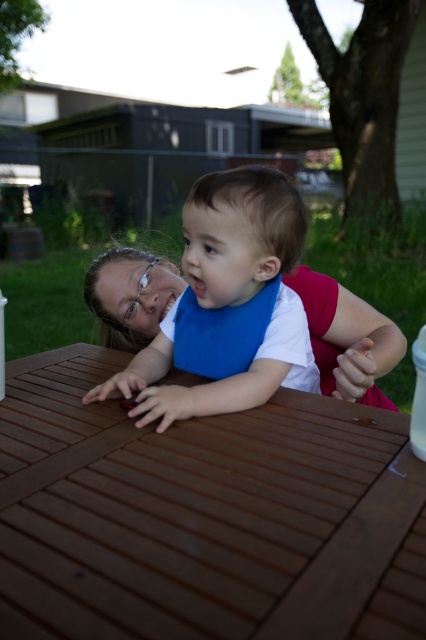
Question: Is brown wooden table at center closer to the viewer compared to blue fabric bib at center?

Choices:
 (A) yes
 (B) no

Answer: (A)

Question: Is brown wooden table at center above blue fabric bib at center?

Choices:
 (A) no
 (B) yes

Answer: (A)

Question: Is brown wooden table at center wider than blue fabric bib at center?

Choices:
 (A) no
 (B) yes

Answer: (B)

Question: Which point is closer to the camera?

Choices:
 (A) (203, 301)
 (B) (405, 547)

Answer: (B)